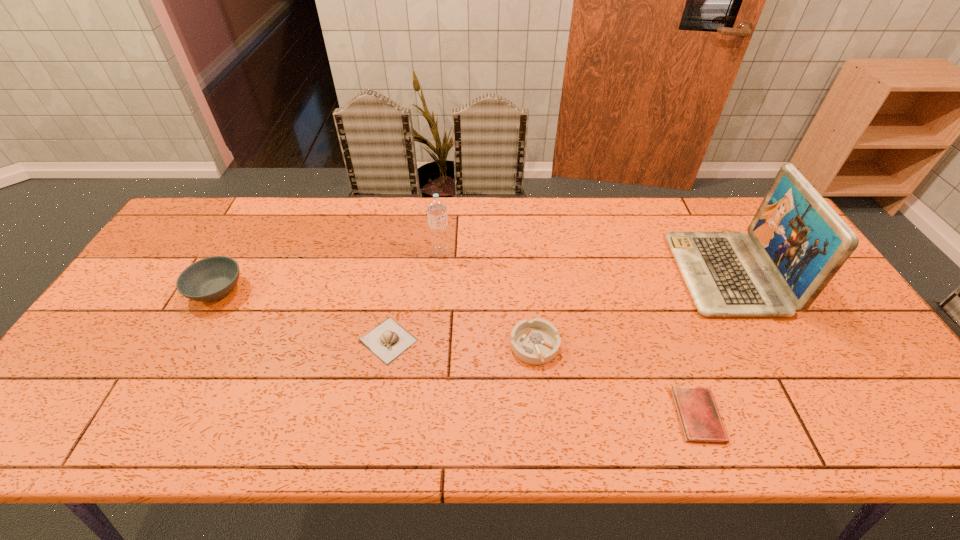
I want to click on object that is at the far edge, so click(803, 241).

The width and height of the screenshot is (960, 540). I want to click on object located in the near edge section of the desktop, so click(699, 417).

Where is `object that is at the left edge`? The height and width of the screenshot is (540, 960). object that is at the left edge is located at coordinates (210, 279).

At what (x,y) coordinates should I click in order to perform the action: click on object that is positioned at the right edge. Please return your answer as a coordinate pair (x, y). The height and width of the screenshot is (540, 960). Looking at the image, I should click on (803, 241).

Identify the location of object located in the far right corner section of the desktop. (803, 241).

In the image, there is a desktop. Where is `free space at the far edge`? The image size is (960, 540). free space at the far edge is located at coordinates (683, 201).

This screenshot has height=540, width=960. I want to click on blank space at the left edge, so click(x=156, y=278).

You are a GUI agent. You are given a task and a screenshot of the screen. Output one action in this format:
    pyautogui.click(x=<x>, y=<y>)
    Task: Click on the vacant space at the right edge of the desktop
    The width and height of the screenshot is (960, 540).
    Given the screenshot: What is the action you would take?
    pyautogui.click(x=845, y=326)

You are a GUI agent. You are given a task and a screenshot of the screen. Output one action in this format:
    pyautogui.click(x=<x>, y=<y>)
    Task: Click on the free point between the laptop computer and the diary
    This screenshot has height=540, width=960.
    Given the screenshot: What is the action you would take?
    pyautogui.click(x=712, y=345)

Image resolution: width=960 pixels, height=540 pixels. I want to click on empty location between the rightmost object and the soup bowl, so click(x=471, y=282).